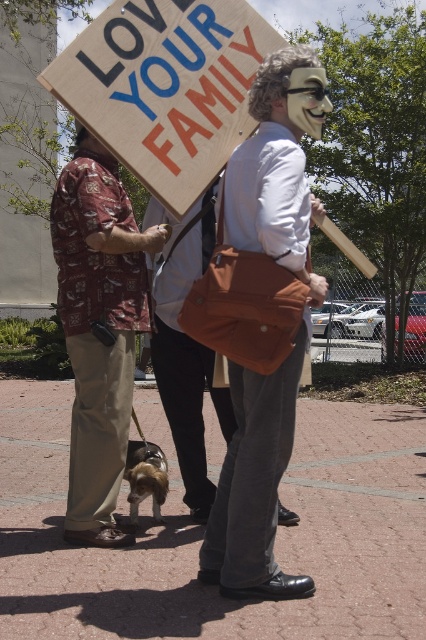
You are standing at the center of the plaza and want to find the wooden sign at upper center. According to the coordinates provided, where should you look relative to your current position?

The wooden sign at upper center is located at coordinates point (166, 88), so you should look slightly to the left and upwards from your current position at the center of the plaza.

You are a delivery person who needs to place a small package in either the matte brown bag at center or the printed fabric shirt at left. Which one can you choose based on their sizes?

The matte brown bag at center is larger in size than the printed fabric shirt at left, so you can choose the matte brown bag at center to place the small package.

You are a pedestrian walking on the sidewalk and see the wooden sign at upper center and the printed fabric shirt at left. Which object is higher in the image?

The wooden sign at upper center is higher than the printed fabric shirt at left.